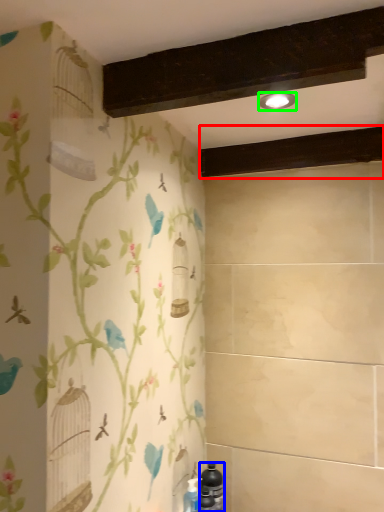
Question: Estimate the real-world distances between objects in this image. Which object is farther from plank (highlighted by a red box), bottle (highlighted by a blue box) or light fixture (highlighted by a green box)?

Choices:
 (A) bottle
 (B) light fixture

Answer: (A)